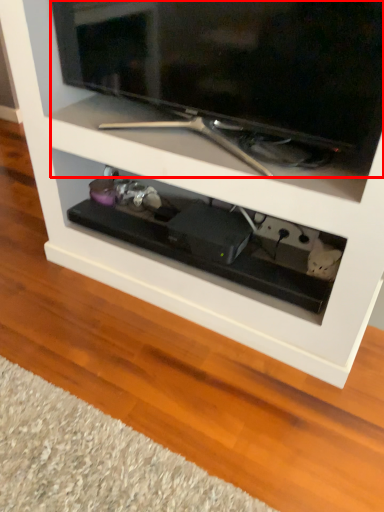
Question: From the image's perspective, where is television (annotated by the red box) located relative to drawer?

Choices:
 (A) below
 (B) above

Answer: (B)